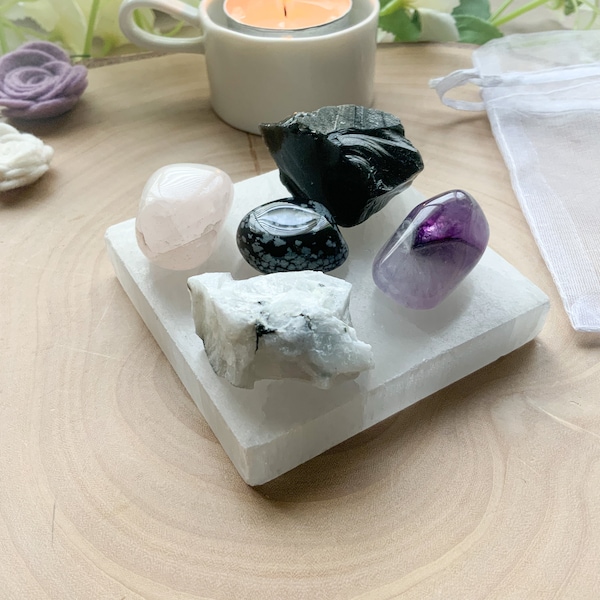
This screenshot has width=600, height=600. I want to click on candle, so click(300, 15).